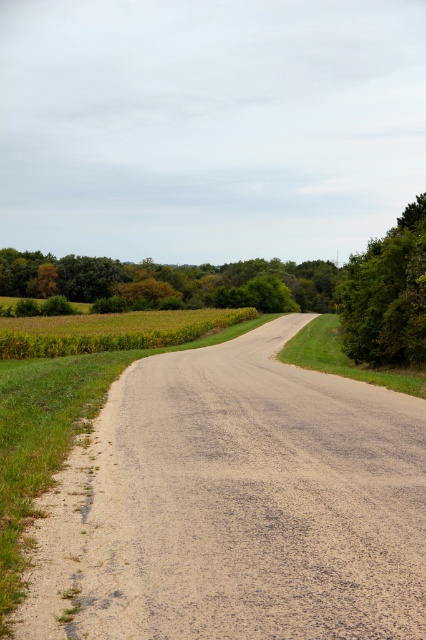
Measure the distance from green leafy trees at center to green grassy field at center-left.

A distance of 57.39 meters exists between green leafy trees at center and green grassy field at center-left.

Which is behind, point (94, 259) or point (120, 323)?

Point (94, 259)

I want to click on green leafy trees at center, so click(166, 280).

Is point (264, 474) behind point (359, 259)?

No, it is in front of (359, 259).

Is dull gray asphalt road at center bigger than green leafy tree at right?

No, dull gray asphalt road at center is not bigger than green leafy tree at right.

Is point (420, 496) behind point (382, 353)?

No, (420, 496) is in front of (382, 353).

This screenshot has width=426, height=640. I want to click on dull gray asphalt road at center, so click(x=235, y=506).

At what (x,y) coordinates should I click in order to perform the action: click on dull gray asphalt road at center. Please return your answer as a coordinate pair (x, y). Looking at the image, I should click on (235, 506).

I want to click on dull gray asphalt road at center, so click(235, 506).